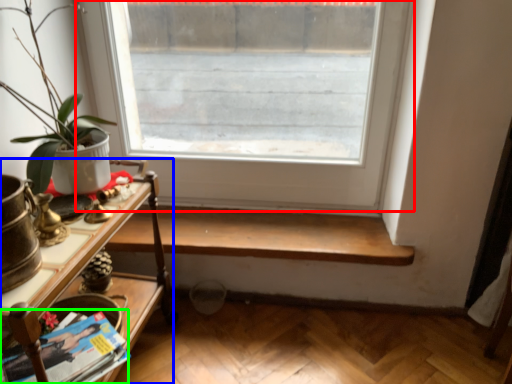
Question: Based on their relative distances, which object is farther from window (highlighted by a red box)? Choose from table (highlighted by a blue box) and magazine (highlighted by a green box).

Choices:
 (A) table
 (B) magazine

Answer: (B)